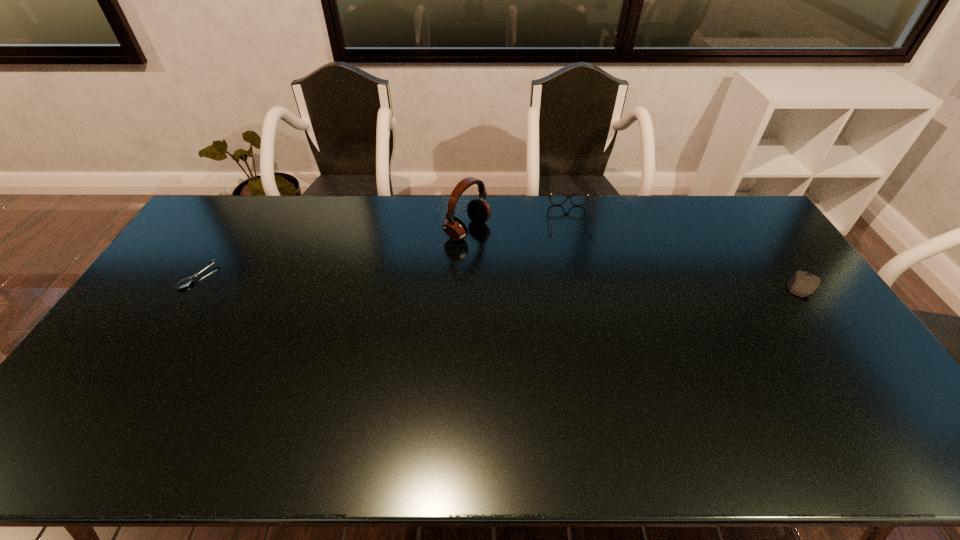
Identify the location of soupspoon. (186, 282).

Identify the location of the leftmost object. (186, 282).

Identify the location of computer equipment. (802, 284).

This screenshot has width=960, height=540. Find the location of `the second shortest object`. the second shortest object is located at coordinates (802, 284).

Image resolution: width=960 pixels, height=540 pixels. What are the coordinates of `the tallest object` in the screenshot? It's located at (478, 210).

At what (x,y) coordinates should I click in order to perform the action: click on headset. Please return your answer as a coordinate pair (x, y). The width and height of the screenshot is (960, 540). Looking at the image, I should click on (478, 210).

This screenshot has height=540, width=960. I want to click on the third shortest object, so click(x=568, y=196).

I want to click on the second object from right to left, so click(x=568, y=196).

You are a GUI agent. You are given a task and a screenshot of the screen. Output one action in this format:
    pyautogui.click(x=<x>, y=<y>)
    Task: Click on the free space located 0.330m on the front of the leftmost object
    The width and height of the screenshot is (960, 540).
    Given the screenshot: What is the action you would take?
    pyautogui.click(x=129, y=384)

Find the location of a particular element. vacant point located on the back of the second shortest object is located at coordinates (771, 244).